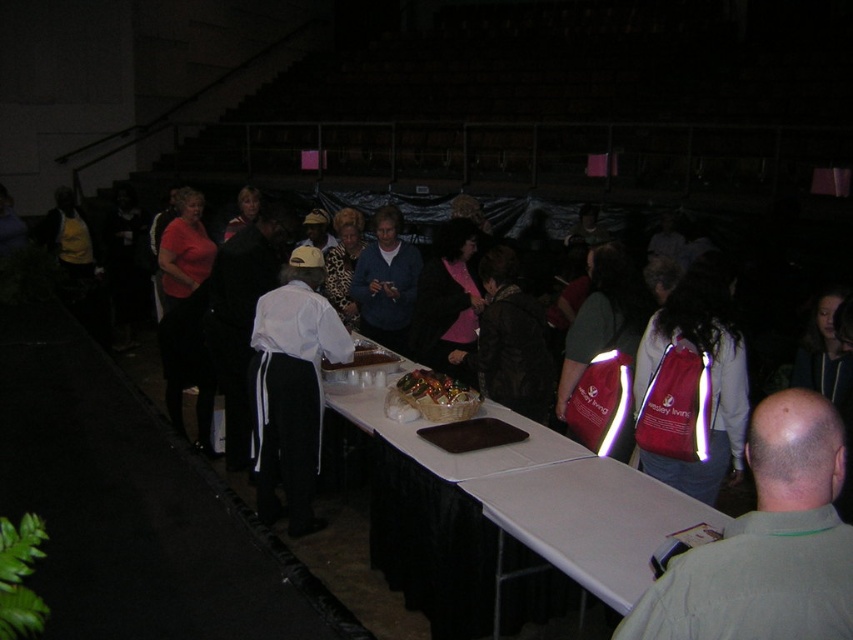
Question: Is white fabric apron at center behind shiny metallic tray at center?

Choices:
 (A) no
 (B) yes

Answer: (B)

Question: Is green fabric shirt at lower right to the left of blue sweater at center from the viewer's perspective?

Choices:
 (A) no
 (B) yes

Answer: (A)

Question: Which object is closer to the camera taking this photo?

Choices:
 (A) shiny metallic tray at center
 (B) red fabric bag at center right
 (C) green fabric shirt at lower right
 (D) white fabric apron at center

Answer: (C)

Question: Which point appears farthest from the camera in this image?

Choices:
 (A) (386, 301)
 (B) (650, 614)
 (C) (720, 524)
 (D) (647, 513)

Answer: (A)

Question: Which point is closer to the camera?

Choices:
 (A) green fabric shirt at lower right
 (B) white fabric apron at center

Answer: (A)

Question: Is red fabric bag at center right above blue sweater at center?

Choices:
 (A) no
 (B) yes

Answer: (A)